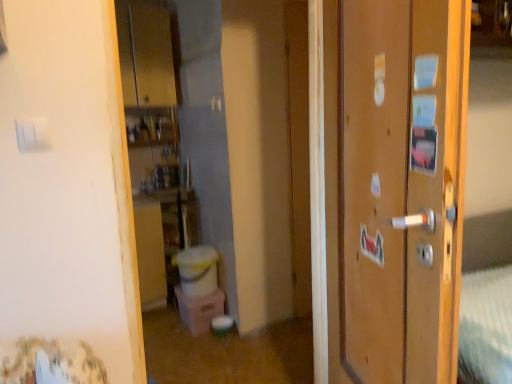
Question: Is white plastic light switch at upper left completely or partially inside wooden door at right?

Choices:
 (A) no
 (B) yes

Answer: (A)

Question: Can you confirm if wooden door at right is shorter than white plastic light switch at upper left?

Choices:
 (A) yes
 (B) no

Answer: (B)

Question: Can you see wooden door at right touching white plastic light switch at upper left?

Choices:
 (A) yes
 (B) no

Answer: (B)

Question: Is wooden door at right not within white plastic light switch at upper left?

Choices:
 (A) yes
 (B) no

Answer: (A)

Question: Does wooden door at right lie in front of white plastic light switch at upper left?

Choices:
 (A) no
 (B) yes

Answer: (B)

Question: Does wooden door at right have a larger size compared to white plastic light switch at upper left?

Choices:
 (A) yes
 (B) no

Answer: (A)

Question: Does white plastic light switch at upper left lie in front of wooden door at right?

Choices:
 (A) no
 (B) yes

Answer: (A)

Question: Does white plastic light switch at upper left appear on the left side of wooden door at right?

Choices:
 (A) yes
 (B) no

Answer: (A)

Question: From a real-world perspective, is white plastic light switch at upper left located beneath wooden door at right?

Choices:
 (A) yes
 (B) no

Answer: (B)

Question: Does white plastic light switch at upper left have a larger size compared to wooden door at right?

Choices:
 (A) no
 (B) yes

Answer: (A)

Question: From a real-world perspective, is white plastic light switch at upper left on top of wooden door at right?

Choices:
 (A) yes
 (B) no

Answer: (A)

Question: Are white plastic light switch at upper left and wooden door at right making contact?

Choices:
 (A) yes
 (B) no

Answer: (B)

Question: In terms of size, does white plastic light switch at upper left appear bigger or smaller than wooden door at right?

Choices:
 (A) big
 (B) small

Answer: (B)